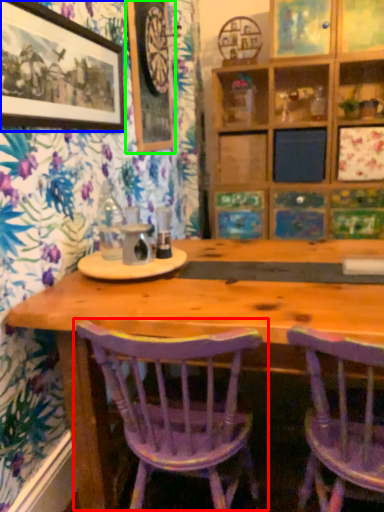
Question: Which object is the closest to the chair (highlighted by a red box)? Choose among these: picture frame (highlighted by a blue box) or picture frame (highlighted by a green box).

Choices:
 (A) picture frame
 (B) picture frame

Answer: (A)